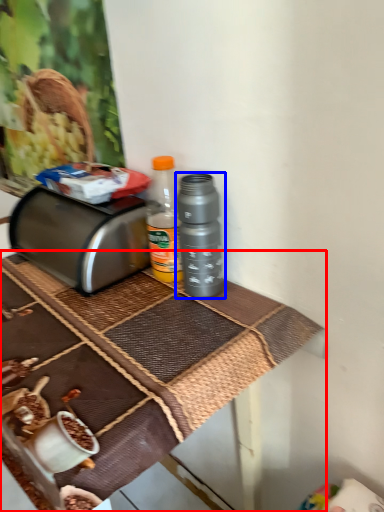
Question: Which object appears closest to the camera in this image, table (highlighted by a red box) or bottle (highlighted by a blue box)?

Choices:
 (A) table
 (B) bottle

Answer: (A)